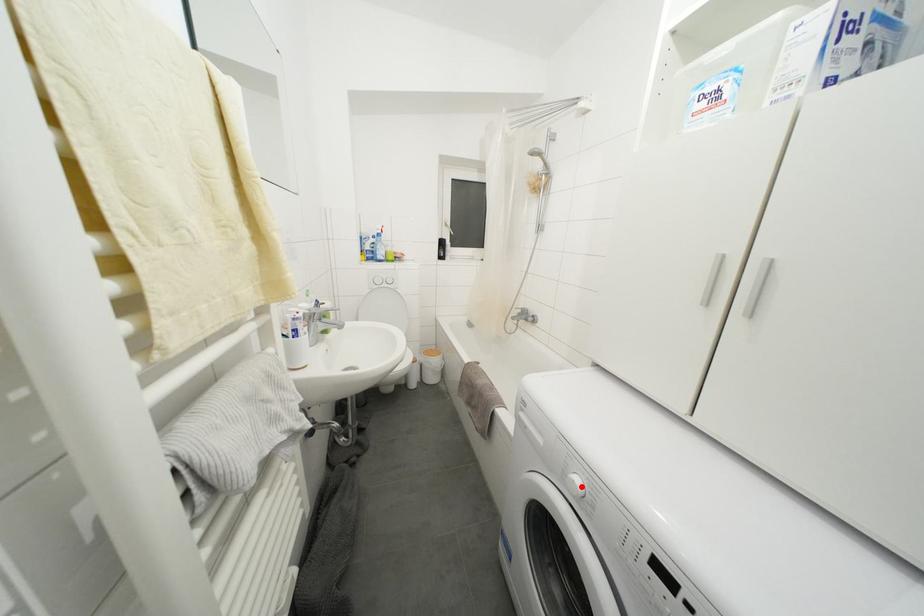
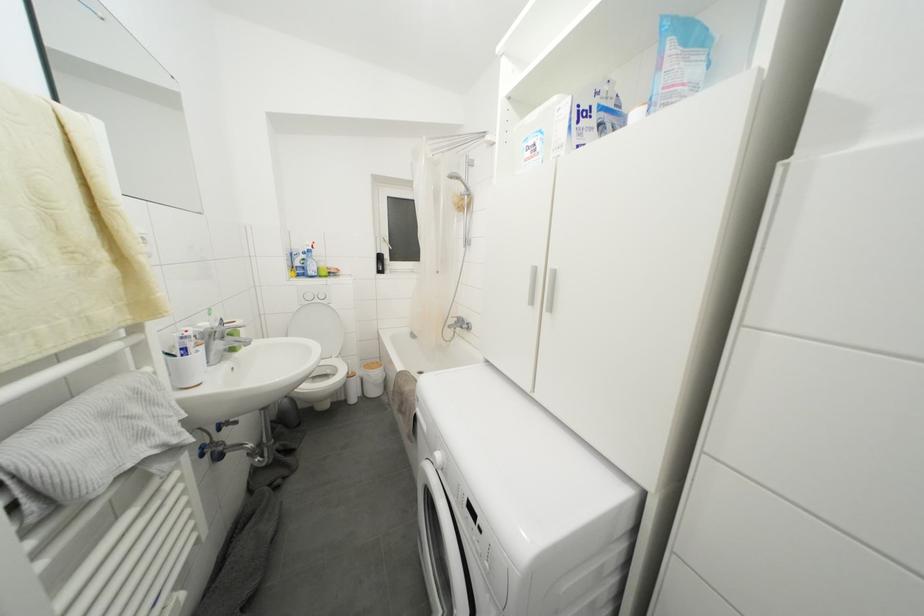
The point at the highlighted location is marked in the first image. Where is the corresponding point in the second image?

(443, 461)